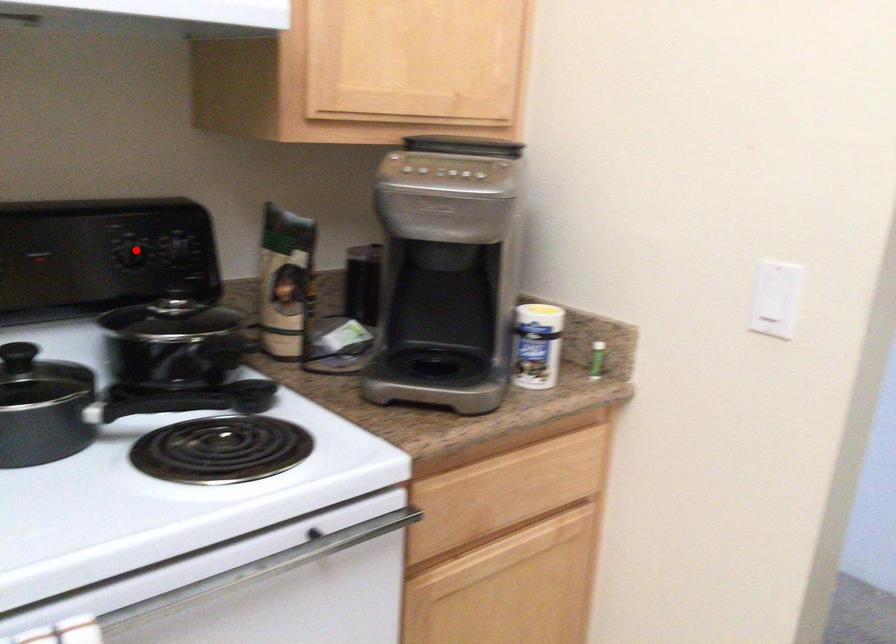
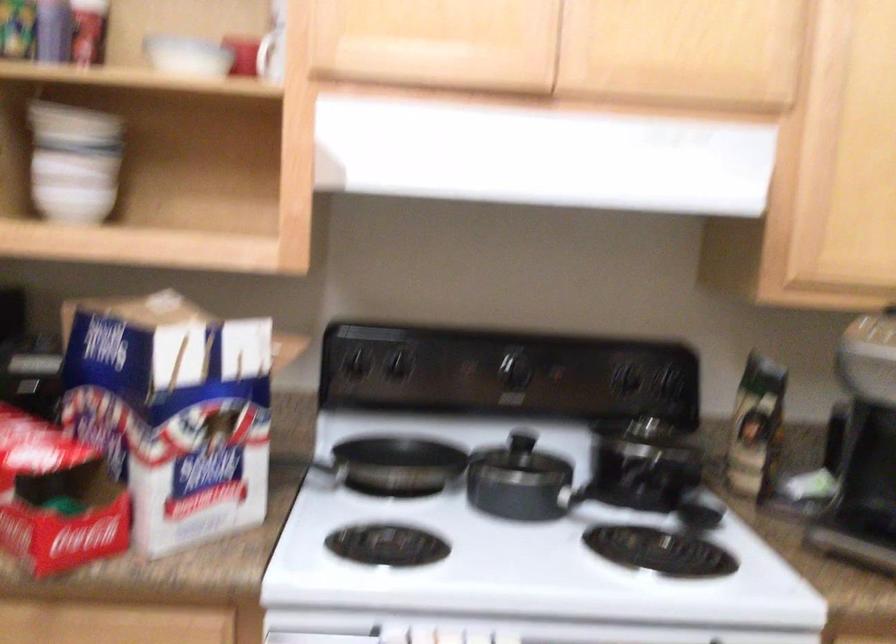
Where in the second image is the point corresponding to the highlighted location from the first image?

(625, 377)